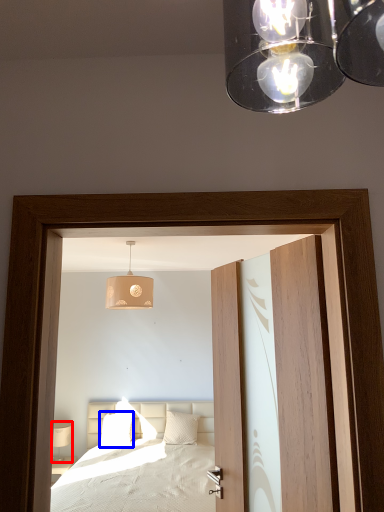
Question: Among these objects, which one is nearest to the camera, table lamp (highlighted by a red box) or pillow (highlighted by a blue box)?

Choices:
 (A) table lamp
 (B) pillow

Answer: (B)